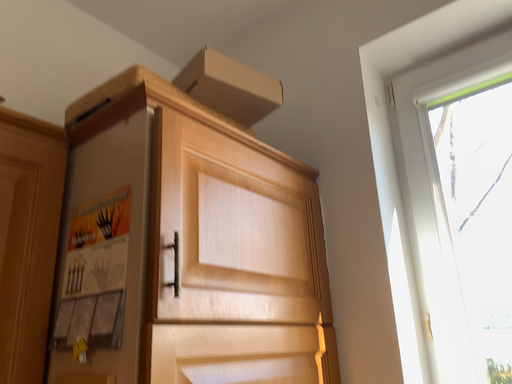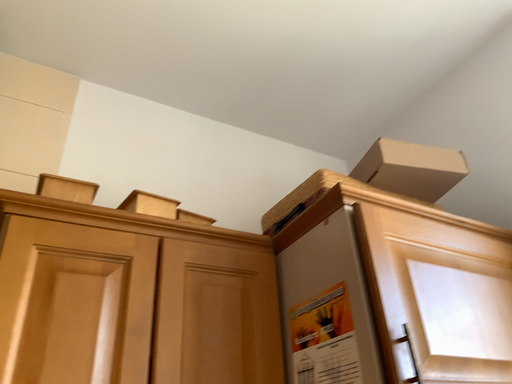
Question: How did the camera likely rotate when shooting the video?

Choices:
 (A) rotated left
 (B) rotated right

Answer: (A)